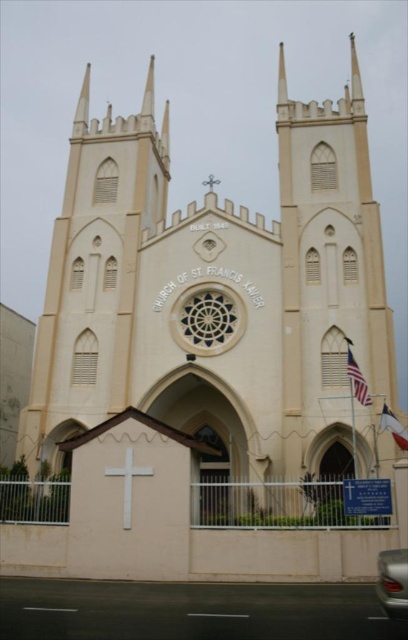
You are standing at the entrance of the Church of St. Francis Xavier and notice two crosses in front of you. The first is a white matte cross at center, and the second is a white wooden cross at center. Which cross is closer to you?

Both the white matte cross at center and the white wooden cross at center are described as being at the center. However, according to the description, they are 33.75 meters apart. This suggests that one of them must be positioned further away from the entrance than the other. Since the question asks which is closer, the answer depends on their exact positions. Unfortunately, the provided information does not specify which cross is nearer. Please check the spatial details again for clarification.

You are standing in front of the Church of St. Francis Xavier and notice two items above the main entrance. The items are the white matte cross at center and the blue fabric flag at center. From your perspective, which one is positioned to the left?

The white matte cross at center is to the left of the blue fabric flag at center, so the white matte cross at center is positioned to the left.

You are a visitor standing in front of the Church of St. Francis Xavier. You notice a white matte cross at center and a blue fabric flag at center. Which object is wider?

The white matte cross at center is wider than the blue fabric flag at center.